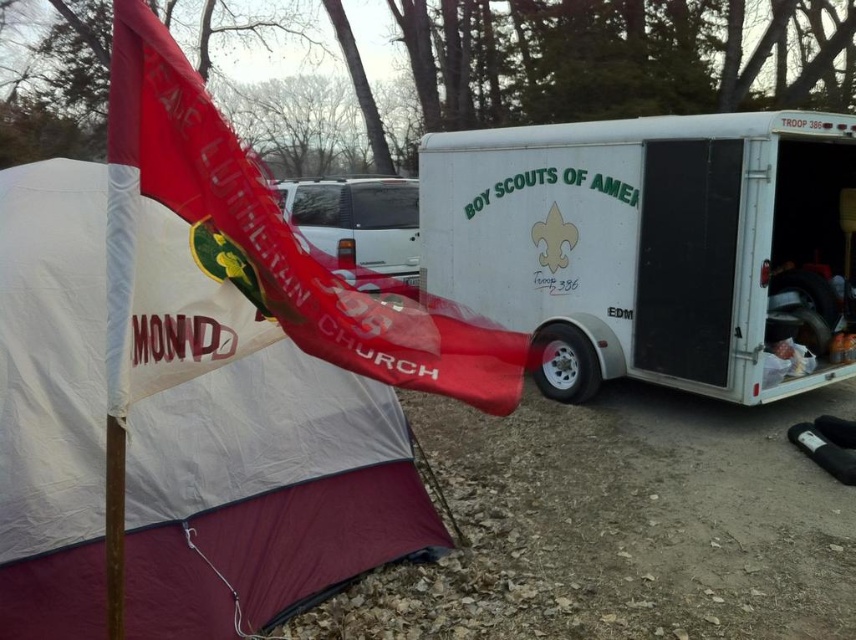
Question: Is white matte trailer at right bigger than red fabric flag at upper left?

Choices:
 (A) no
 (B) yes

Answer: (B)

Question: Where is white matte trailer at right located in relation to red fabric flag at upper left in the image?

Choices:
 (A) below
 (B) above

Answer: (B)

Question: Which object is the closest to the red fabric flag at upper left?

Choices:
 (A) white nylon tent at left
 (B) white matte trailer at right

Answer: (A)

Question: Considering the real-world distances, which object is closest to the red fabric flag at upper left?

Choices:
 (A) white nylon tent at left
 (B) white matte trailer at right

Answer: (A)

Question: Which point is farther to the camera?

Choices:
 (A) white nylon tent at left
 (B) red fabric flag at upper left
 (C) white matte trailer at right

Answer: (C)

Question: Is white nylon tent at left behind red fabric flag at upper left?

Choices:
 (A) yes
 (B) no

Answer: (A)